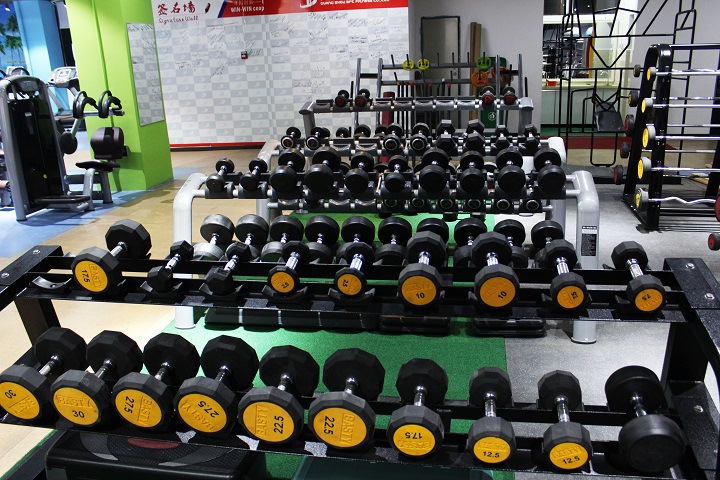
Find the location of a particular element. The height and width of the screenshot is (480, 720). number of dumbbell racks is located at coordinates (x=27, y=269), (x=186, y=200), (x=266, y=147), (x=304, y=106).